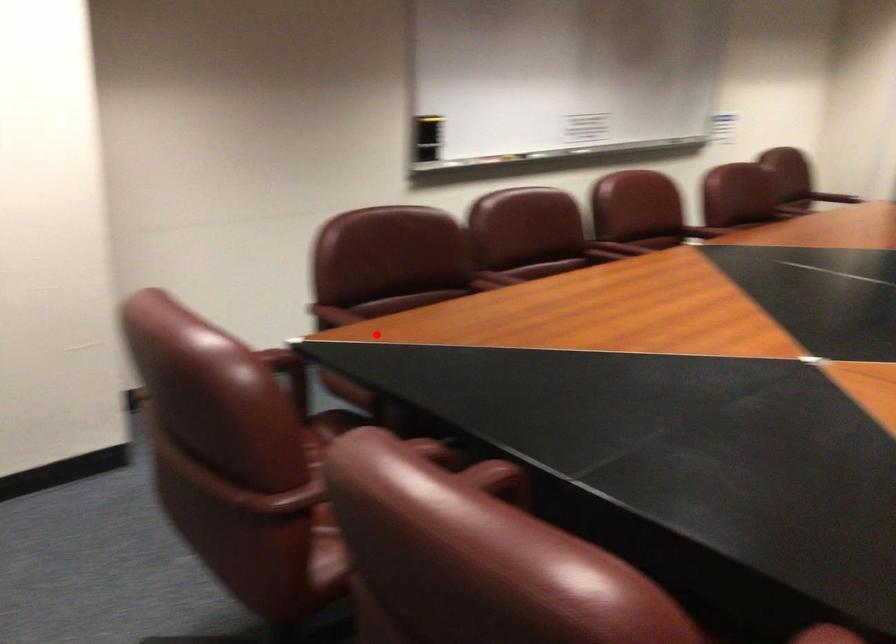
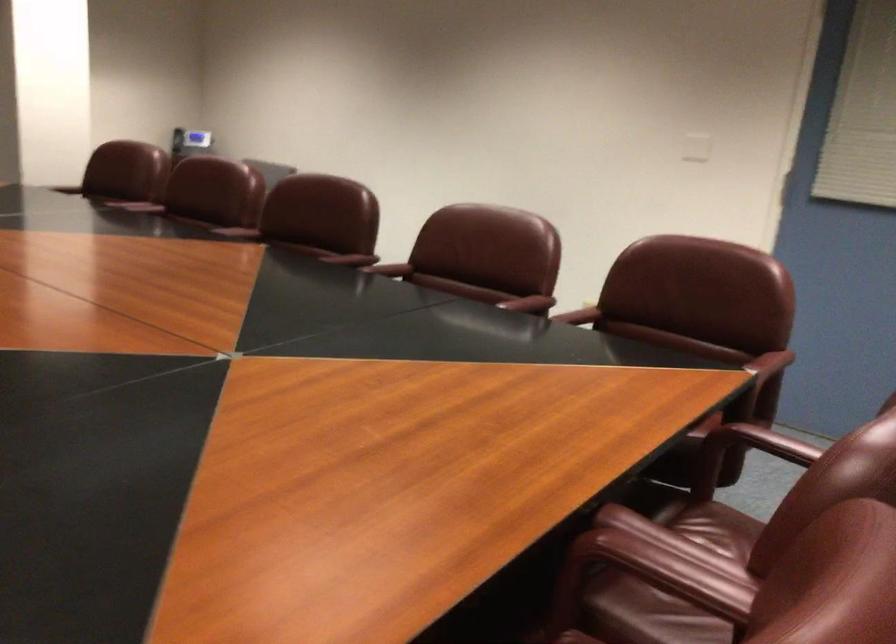
Locate, in the second image, the point that corresponds to the highlighted location in the first image.

(761, 442)